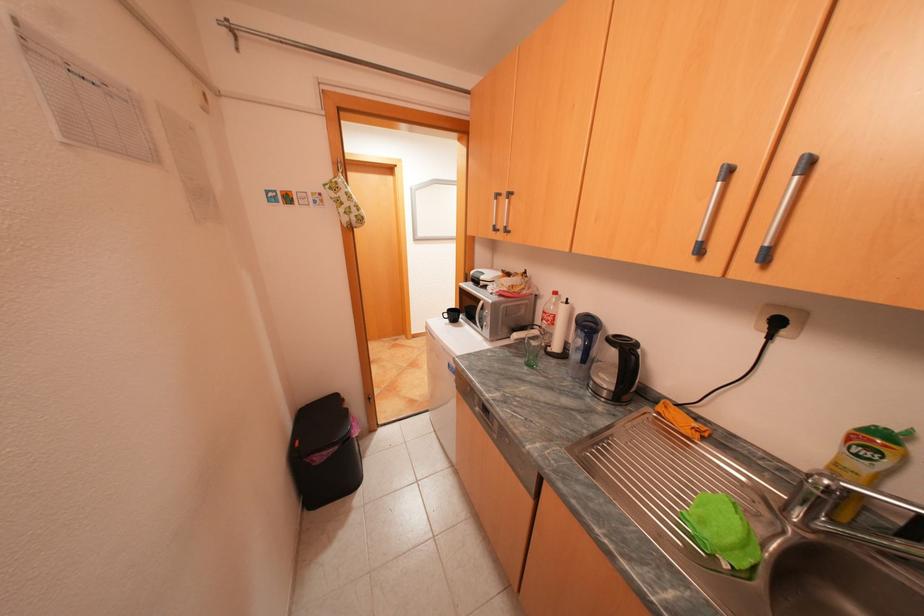
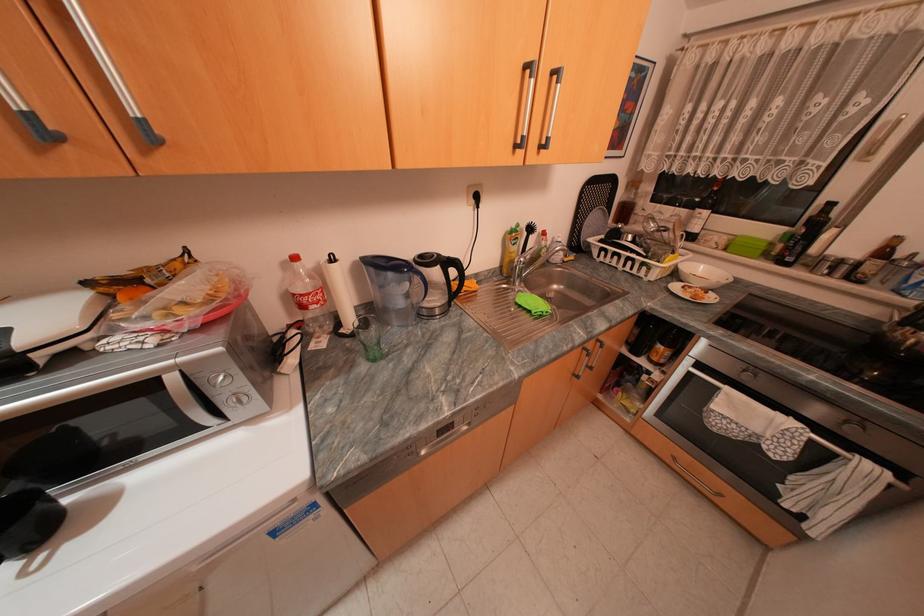
Locate, in the second image, the point that corresponds to (x=789, y=469) in the first image.

(503, 273)